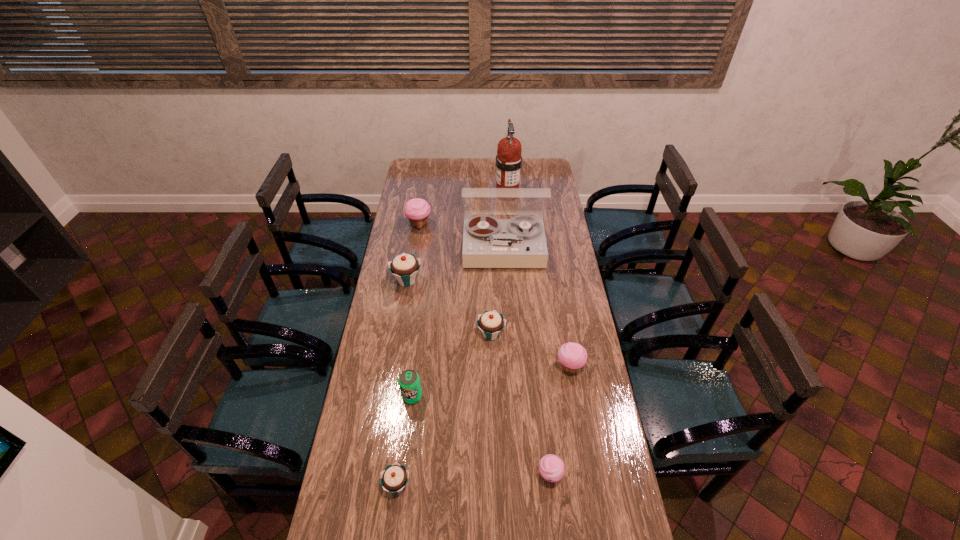
Locate an element on the screen. the tallest object is located at coordinates (508, 159).

Locate an element on the screen. This screenshot has width=960, height=540. fire extinguisher is located at coordinates (508, 159).

Locate an element on the screen. white record player is located at coordinates (520, 242).

The image size is (960, 540). Identify the location of record player. pos(520,242).

This screenshot has height=540, width=960. What are the coordinates of `the farthest cupcake` in the screenshot? It's located at (417, 210).

This screenshot has width=960, height=540. I want to click on the biggest pink cupcake, so click(x=417, y=210).

Find the location of a particular element. The height and width of the screenshot is (540, 960). the second farthest cupcake is located at coordinates (404, 267).

Where is `the biggest teal cupcake`? the biggest teal cupcake is located at coordinates (404, 267).

Identify the location of the seventh farthest object. The height and width of the screenshot is (540, 960). (409, 381).

Locate an element on the screen. The image size is (960, 540). the second smallest pink cupcake is located at coordinates (572, 356).